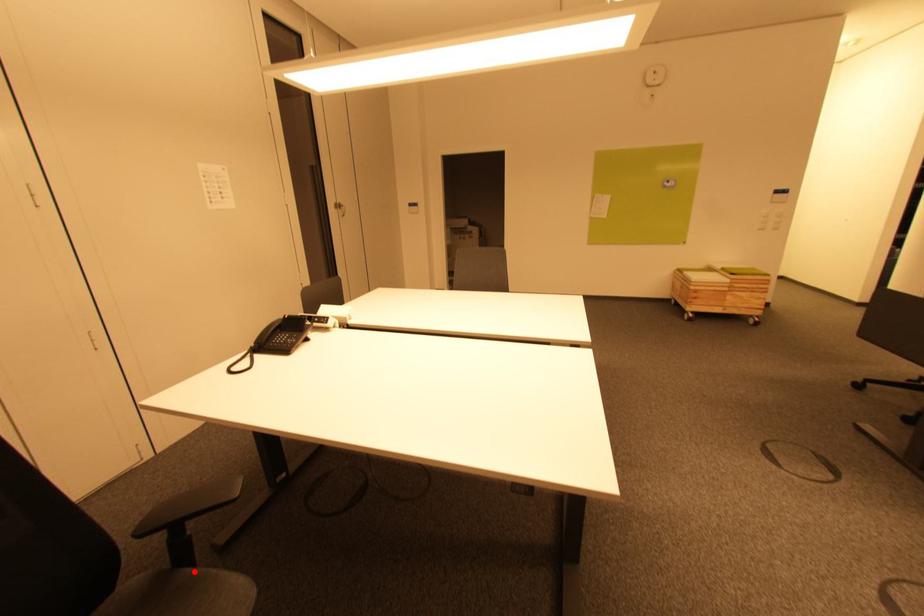
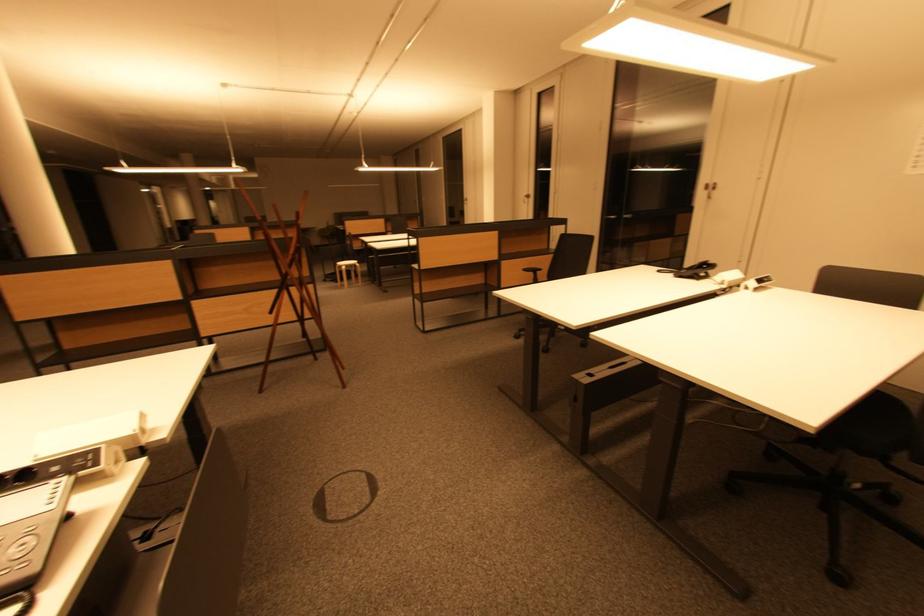
Question: I am providing you with two images of the same scene from different viewpoints. A red point is marked on the first image. Is the red point's position out of view in image 2?

Choices:
 (A) Yes
 (B) No

Answer: (A)